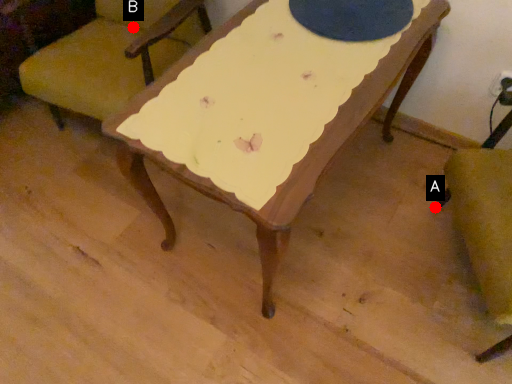
Question: Two points are circled on the image, labeled by A and B beside each circle. Which of the following is the closest to the observer?

Choices:
 (A) A is closer
 (B) B is closer

Answer: (A)